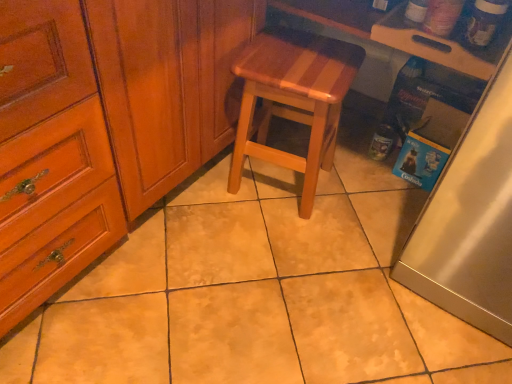
Identify the location of free spot to the left of satin silver fridge at right. (343, 247).